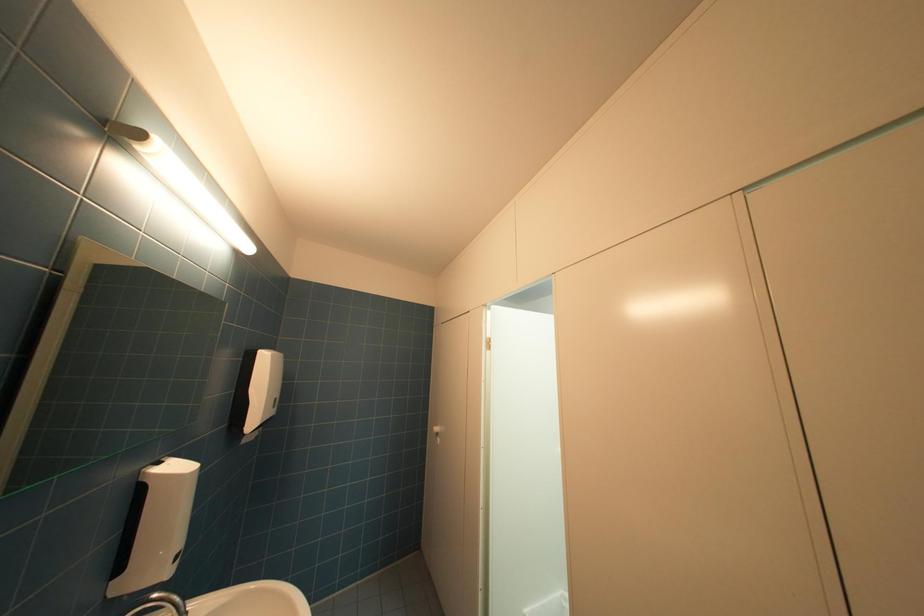
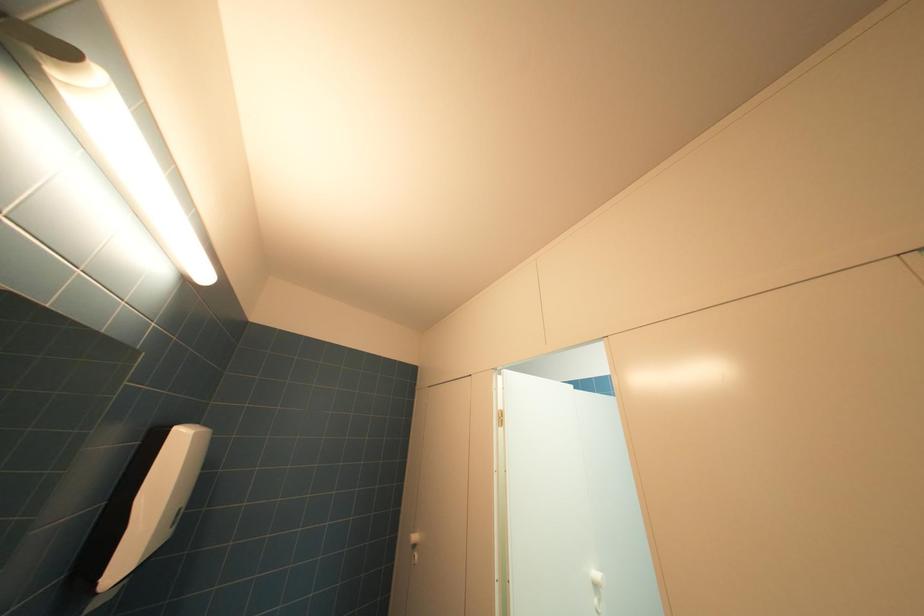
Question: Based on the continuous images, in which direction is the camera rotating? Reply with the corresponding letter.

Choices:
 (A) Left
 (B) Right
 (C) Up
 (D) Down

Answer: (C)